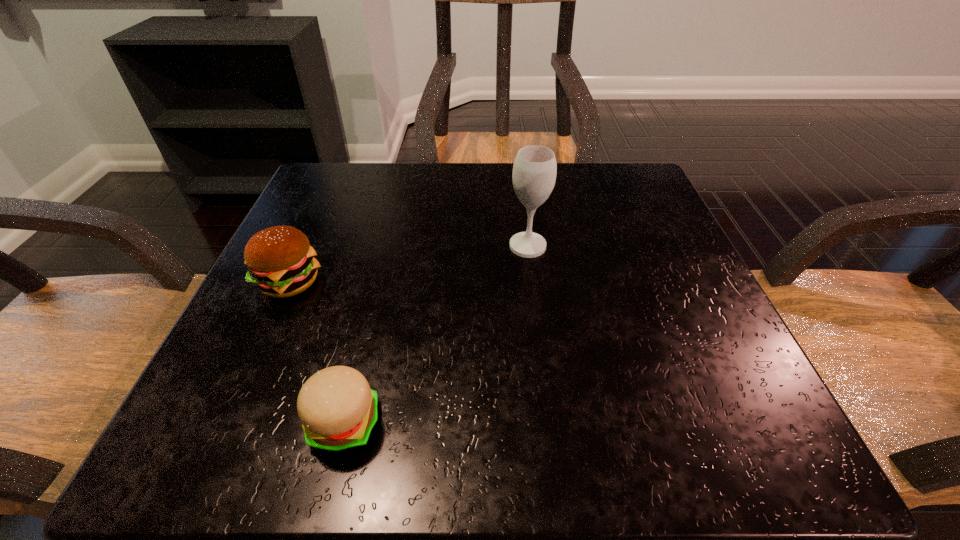
This screenshot has width=960, height=540. I want to click on object at the near left corner, so click(338, 410).

This screenshot has height=540, width=960. I want to click on free space at the far edge of the desktop, so click(509, 200).

In the image, there is a desktop. Identify the location of free space at the near edge. The width and height of the screenshot is (960, 540). (606, 422).

This screenshot has height=540, width=960. Identify the location of vacant space at the left edge of the desktop. (204, 383).

You are a GUI agent. You are given a task and a screenshot of the screen. Output one action in this format:
    pyautogui.click(x=<x>, y=<y>)
    Task: Click on the free space at the right edge of the desktop
    This screenshot has height=540, width=960.
    Given the screenshot: What is the action you would take?
    pyautogui.click(x=666, y=258)

Where is `free space at the far left corner of the desktop`? This screenshot has width=960, height=540. free space at the far left corner of the desktop is located at coordinates (333, 184).

I want to click on free space at the far right corner of the desktop, so click(593, 164).

Identify the location of free space between the taller hamburger and the farthest object. The width and height of the screenshot is (960, 540). (409, 264).

I want to click on vacant region between the taller hamburger and the nearest object, so (317, 353).

Where is `empty space between the second object from left to right and the farther hamburger`? This screenshot has width=960, height=540. empty space between the second object from left to right and the farther hamburger is located at coordinates (317, 353).